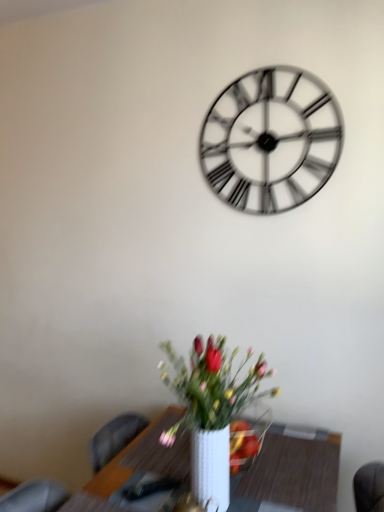
Find the location of a particular element. The image size is (384, 512). free space above white glossy table at lower center (from a real-world perspective) is located at coordinates (244, 466).